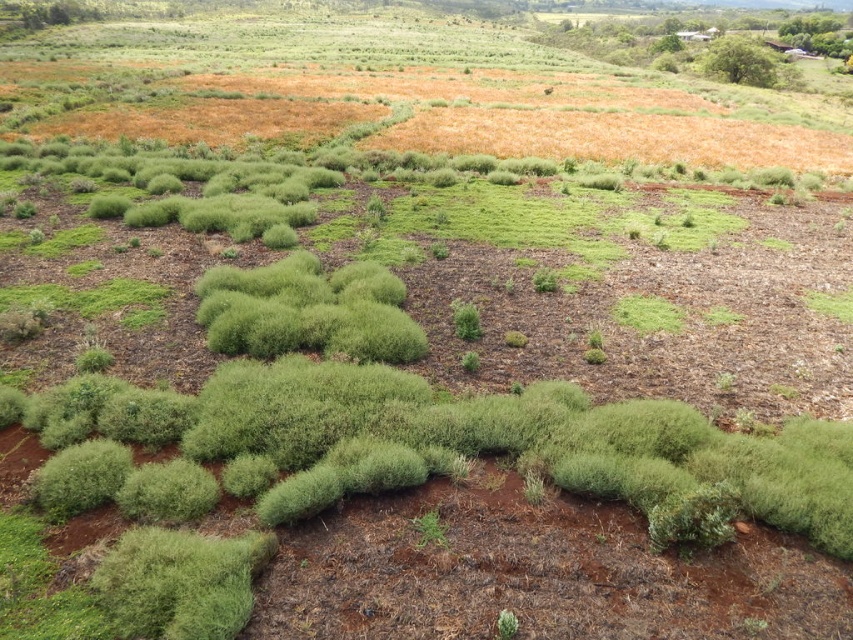
Is point (738, 58) in front of point (428, 540)?

No.

What do you see at coordinates (738, 61) in the screenshot?
I see `green leafy bush at upper right` at bounding box center [738, 61].

You are a GUI agent. You are given a task and a screenshot of the screen. Output one action in this format:
    pyautogui.click(x=<x>, y=<y>)
    Task: Click on the green leafy bush at upper right
    
    Given the screenshot: What is the action you would take?
    pyautogui.click(x=738, y=61)